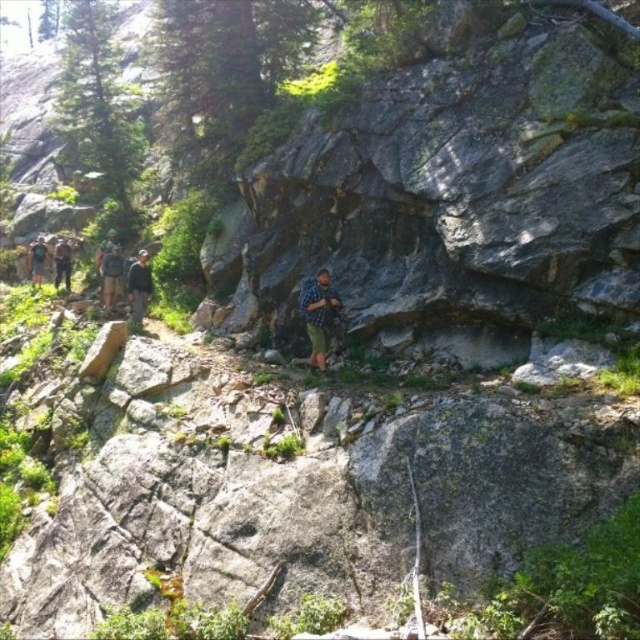
Is dark gray backpack at center thinner than camouflage fabric backpack at left?

No.

Locate an element on the screen. This screenshot has width=640, height=640. dark gray backpack at center is located at coordinates (140, 285).

Where is `dark gray backpack at center`? dark gray backpack at center is located at coordinates (140, 285).

Who is more distant from viewer, (323, 362) or (109, 257)?

Positioned behind is point (109, 257).

Who is lower down, blue plaid shirt at center or green fabric backpack at left?

Positioned lower is blue plaid shirt at center.

Between point (323, 369) and point (116, 257), which one is positioned in front?

Point (323, 369) is more forward.

This screenshot has height=640, width=640. I want to click on blue plaid shirt at center, so click(317, 314).

Is gray rough rock at center above camouflage backpack at left?

Yes.

Is point (276, 308) in front of point (40, 253)?

Yes, point (276, 308) is closer to viewer.

You are a GUI agent. You are given a task and a screenshot of the screen. Output one action in this format:
    pyautogui.click(x=<x>, y=<y>)
    Task: Click on the gray rough rock at center
    
    Given the screenshot: What is the action you would take?
    pyautogui.click(x=452, y=189)

Where is `gray rough rock at center`? The image size is (640, 640). gray rough rock at center is located at coordinates click(x=452, y=189).